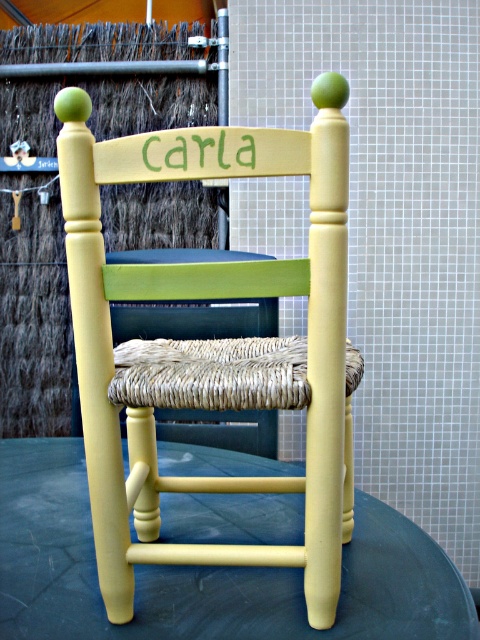
You are arranging a small tea set on the yellow painted wood round table at center. You want to place a teapot in the center of the table. Where should you place the teapot so that it doesn not block the view of the matte yellow wood chair at center?

Place the teapot in the center of the yellow painted wood round table at center, as the matte yellow wood chair at center is positioned on the right side of the table and will not block the view from the center placement.

You are standing in front of the wooden chair named Carla. There are two points marked on the chair. One is at coordinate point (173, 385) and the other is at point (45, 513). Which point is closer to you?

Point (173, 385) is closer to the viewer than point (45, 513).